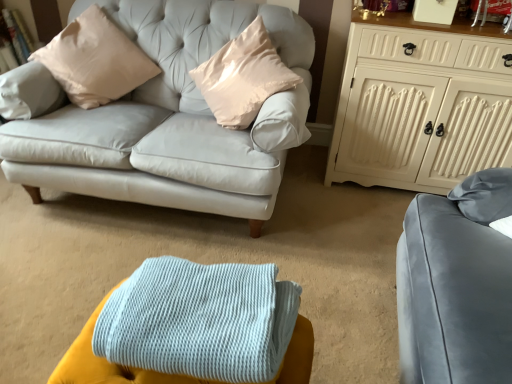
Question: In terms of width, does white painted wood cabinet at upper right look wider or thinner when compared to satin beige pillow at upper left?

Choices:
 (A) wide
 (B) thin

Answer: (B)

Question: From the image's perspective, relative to satin beige pillow at upper left, is white painted wood cabinet at upper right above or below?

Choices:
 (A) below
 (B) above

Answer: (A)

Question: Which of these objects is positioned farthest from the satin beige pillow at upper left?

Choices:
 (A) white painted wood cabinet at upper right
 (B) light blue knitted blanket at lower center

Answer: (B)

Question: Which object is positioned farthest from the white painted wood cabinet at upper right?

Choices:
 (A) light blue knitted blanket at lower center
 (B) satin beige pillow at upper left

Answer: (A)